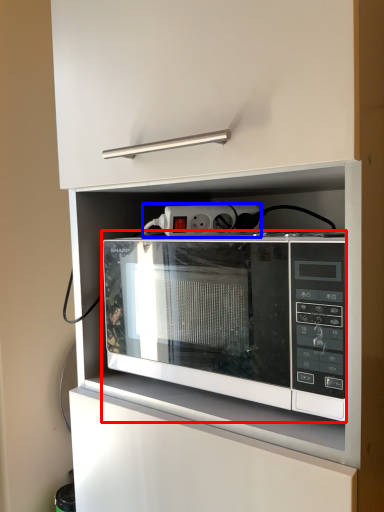
Question: Which object appears farthest to the camera in this image, microwave oven (highlighted by a red box) or electric outlet (highlighted by a blue box)?

Choices:
 (A) microwave oven
 (B) electric outlet

Answer: (B)